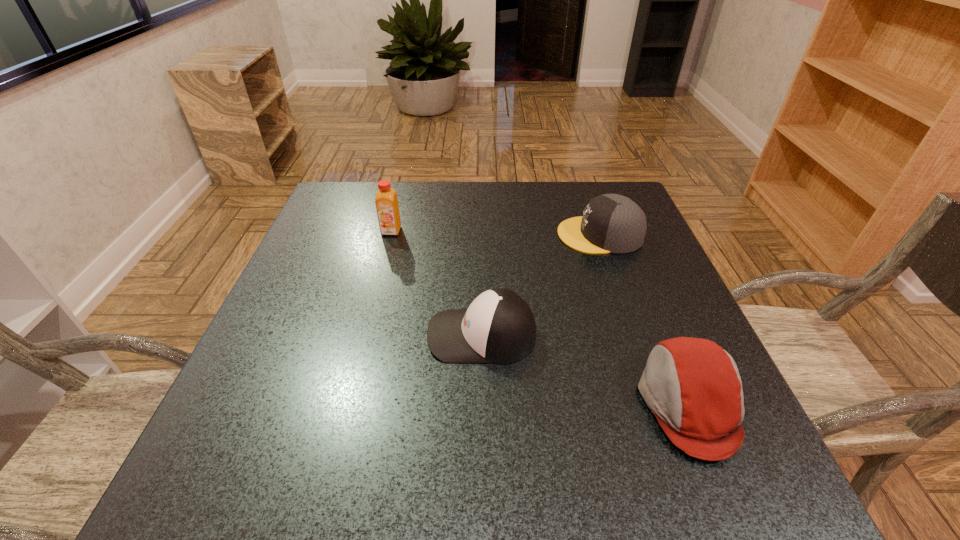
Locate an element on the screen. The image size is (960, 540). vacant space at the far left corner of the desktop is located at coordinates (338, 205).

This screenshot has width=960, height=540. I want to click on free space at the near left corner of the desktop, so click(231, 445).

At what (x,y) coordinates should I click in order to perform the action: click on vacant space that is in between the leftmost object and the leftmost cap. Please return your answer as a coordinate pair (x, y). This screenshot has width=960, height=540. Looking at the image, I should click on (437, 283).

This screenshot has height=540, width=960. In order to click on free point between the farthest cap and the second object from left to right in this screenshot , I will do `click(540, 285)`.

Identify the location of vacant point located between the farthest cap and the orange juice. This screenshot has width=960, height=540. (495, 233).

The width and height of the screenshot is (960, 540). I want to click on free space between the leftmost object and the farthest cap, so click(495, 233).

The image size is (960, 540). What are the coordinates of `empty space between the leftmost cap and the tallest object` in the screenshot? It's located at (437, 283).

Locate an element on the screen. The image size is (960, 540). vacant area that lies between the tallest object and the farthest cap is located at coordinates (495, 233).

This screenshot has width=960, height=540. Identify the location of empty space between the leftmost object and the leftmost cap. (437, 283).

Where is `free space between the farthest cap and the third object from right to left`? The height and width of the screenshot is (540, 960). free space between the farthest cap and the third object from right to left is located at coordinates (540, 285).